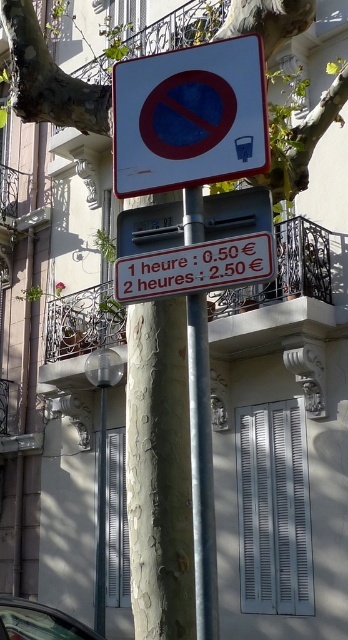
Question: Among these points, which one is nearest to the camera?

Choices:
 (A) (267, 148)
 (B) (193, 349)
 (C) (3, 595)

Answer: (A)

Question: Among these objects, which one is nearest to the camera?

Choices:
 (A) white plastic sign at upper center
 (B) silver metallic pole at center

Answer: (B)

Question: Does white plastic sign at upper center come in front of metallic silver car at lower left?

Choices:
 (A) no
 (B) yes

Answer: (B)

Question: Is white plastic sign at upper center smaller than metallic silver car at lower left?

Choices:
 (A) no
 (B) yes

Answer: (A)

Question: Which point is farther from the camera taking this photo?

Choices:
 (A) (202, 566)
 (B) (64, 618)
 (C) (138, 177)

Answer: (B)

Question: Is silver metallic pole at center below metallic silver car at lower left?

Choices:
 (A) yes
 (B) no

Answer: (B)